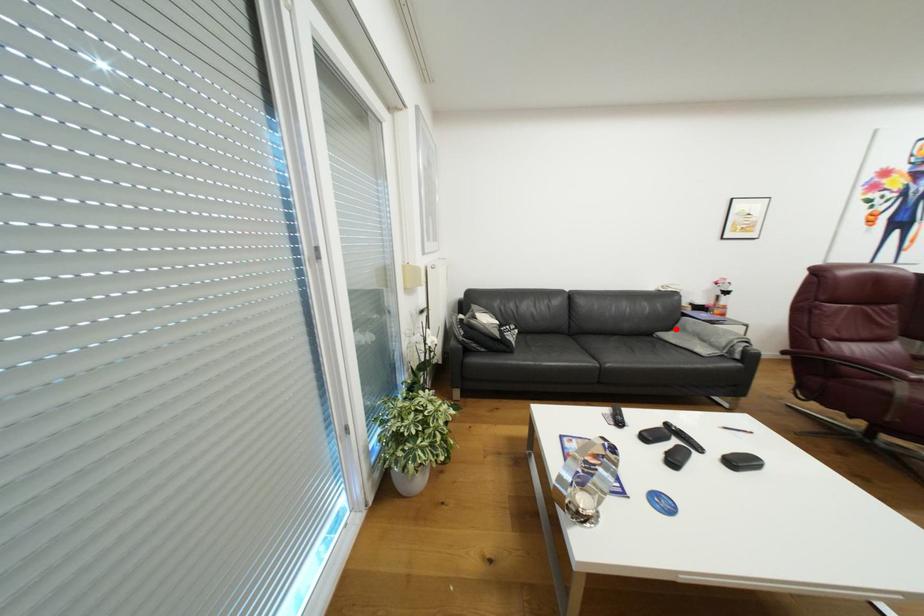
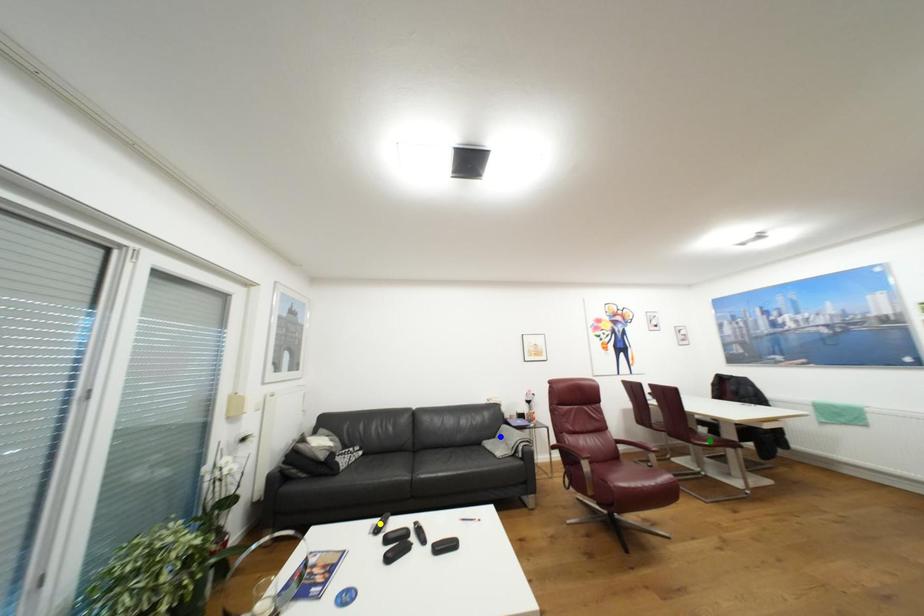
Question: I am providing you with two images of the same scene from different viewpoints. A red point is marked on the first image. You are given multiple points on the second image. Which point in image 2 represents the same 3d spot as the red point in image 1?

Choices:
 (A) green point
 (B) yellow point
 (C) blue point

Answer: (C)